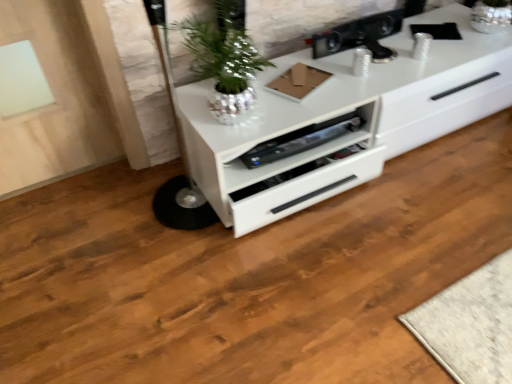
Where is `free spot to the right of metallic black speaker at upper center, the second appliance when ordered from bottom to top`? free spot to the right of metallic black speaker at upper center, the second appliance when ordered from bottom to top is located at coordinates (430, 50).